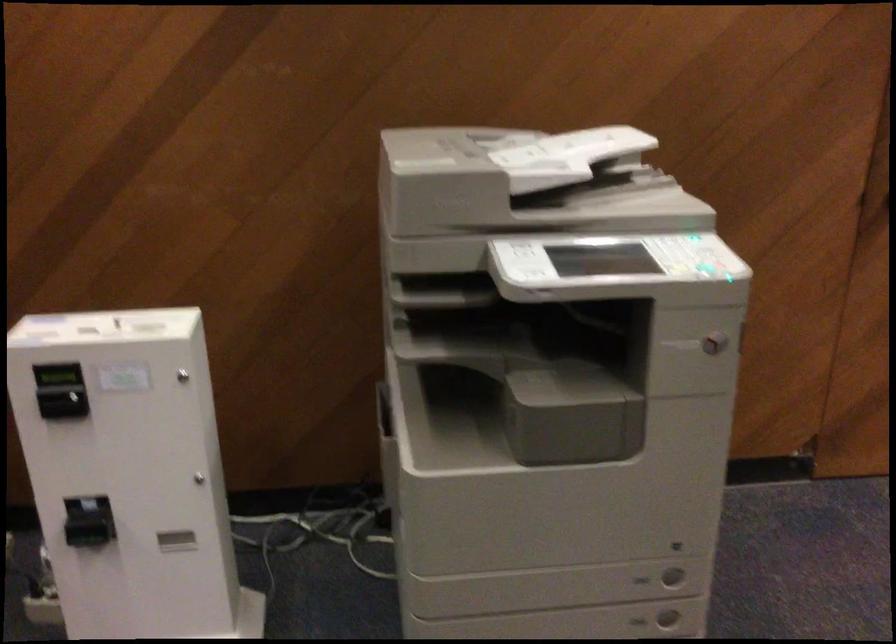
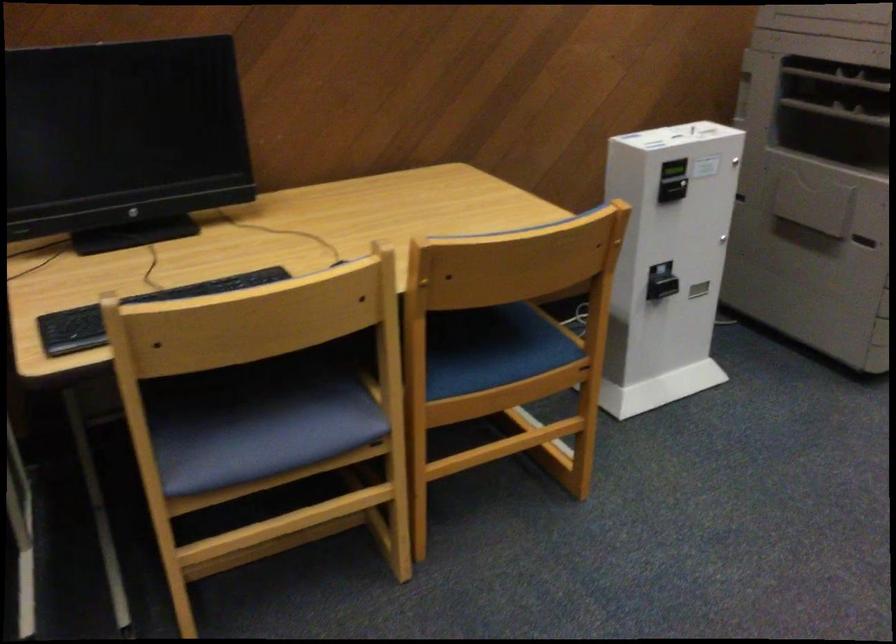
Find the pixel in the second image that matches (x=389, y=328) in the first image.

(836, 111)